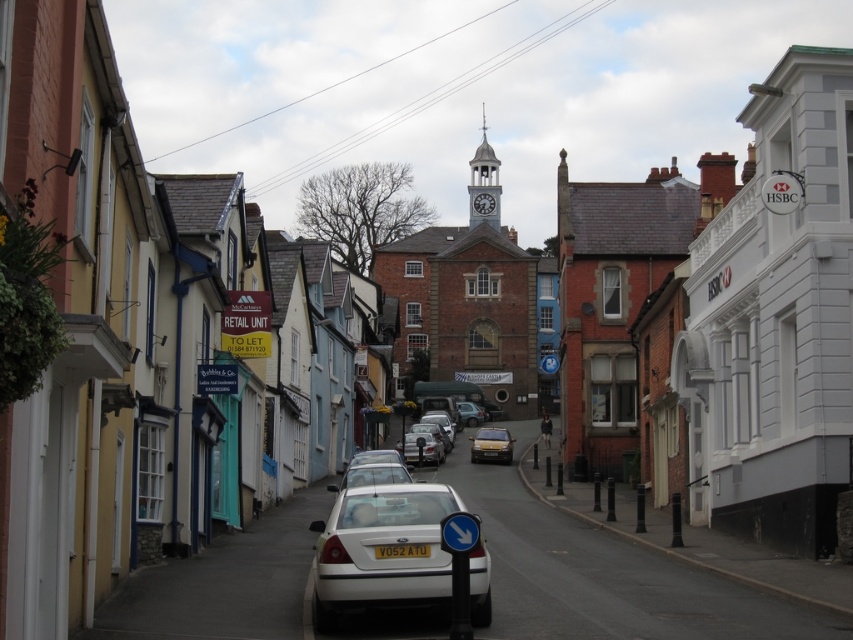
Question: Is white matte sedan at center closer to the viewer compared to gold metallic car at center?

Choices:
 (A) yes
 (B) no

Answer: (A)

Question: Which of the following is the closest to the observer?

Choices:
 (A) (401, 548)
 (B) (430, 525)

Answer: (A)

Question: Which of the following is the farthest from the observer?

Choices:
 (A) polished brass clock tower at center
 (B) gold metallic car at center
 (C) white matte sedan at center

Answer: (A)

Question: Is gold metallic car at center positioned before yellow matte license plate at center?

Choices:
 (A) no
 (B) yes

Answer: (A)

Question: Can you confirm if gold metallic car at center is positioned below yellow matte license plate at center?

Choices:
 (A) no
 (B) yes

Answer: (B)

Question: Estimate the real-world distances between objects in this image. Which object is closer to the polished brass clock tower at center?

Choices:
 (A) white matte sedan at center
 (B) yellow matte license plate at center
 (C) gold metallic car at center

Answer: (C)